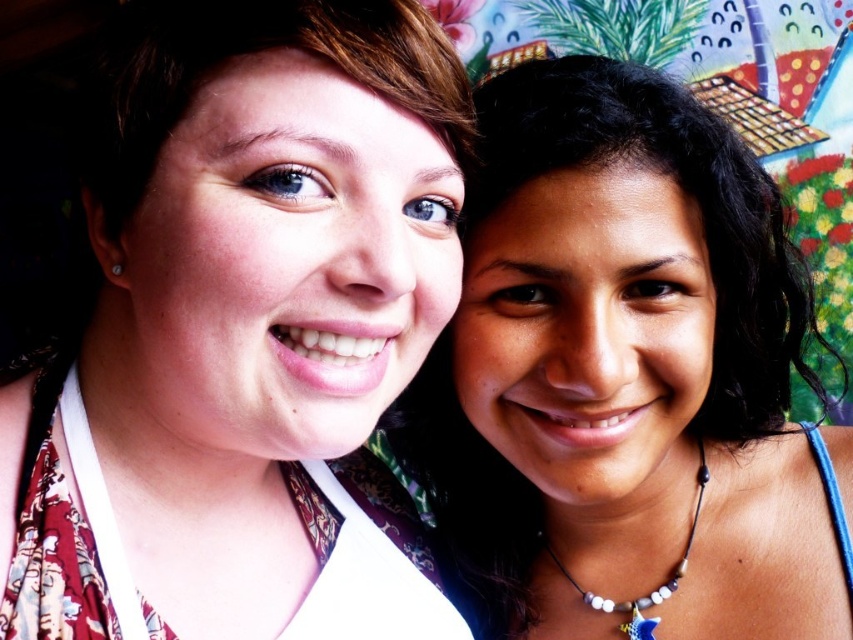
Question: Which of these objects is positioned farthest from the matte floral dress at center?

Choices:
 (A) smooth skin face at center
 (B) beige beaded necklace with star pendant at lower right

Answer: (B)

Question: Which point is closer to the camera?

Choices:
 (A) (354, 154)
 (B) (720, 230)

Answer: (A)

Question: Can you confirm if smooth skin face at center is positioned to the right of beige beaded necklace with star pendant at lower right?

Choices:
 (A) yes
 (B) no

Answer: (B)

Question: Does smooth skin face at center have a lesser width compared to beige beaded necklace with star pendant at lower right?

Choices:
 (A) yes
 (B) no

Answer: (B)

Question: Which object is positioned farthest from the smooth skin face at center?

Choices:
 (A) beige beaded necklace with star pendant at lower right
 (B) matte floral dress at center

Answer: (B)

Question: From the image, what is the correct spatial relationship of matte floral dress at center in relation to beige beaded necklace with star pendant at lower right?

Choices:
 (A) left
 (B) right

Answer: (A)